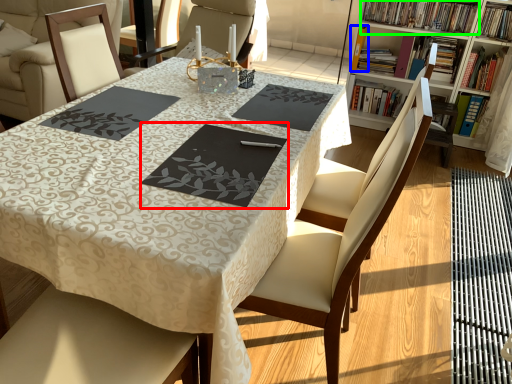
Question: Which object is the closest to the place mat (highlighted by a red box)? Choose among these: book (highlighted by a blue box) or book (highlighted by a green box).

Choices:
 (A) book
 (B) book

Answer: (B)